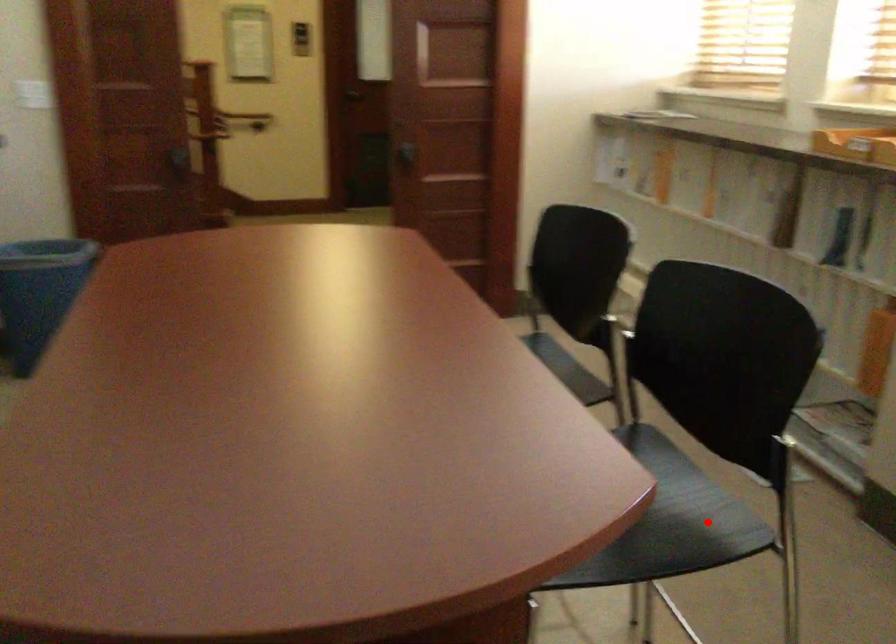
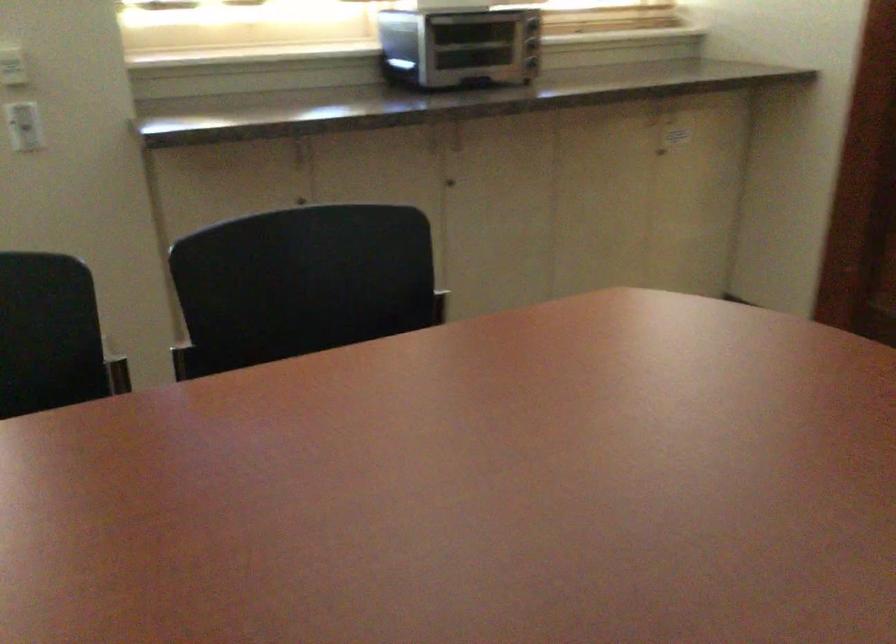
Question: I am providing you with two images of the same scene from different viewpoints. A red point is marked on the first image. Is the red point's position out of view in image 2?

Choices:
 (A) Yes
 (B) No

Answer: (A)